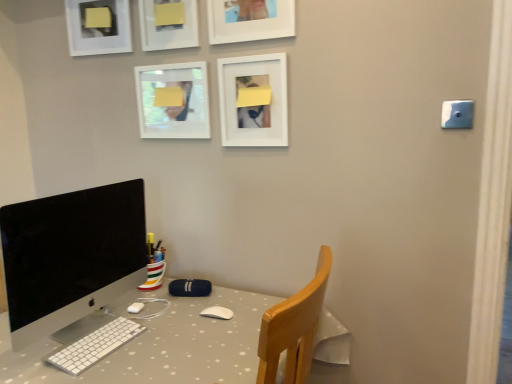
Question: From the image's perspective, is white glossy picture frame at upper center, which appears as the 2th picture frame when viewed from the left, positioned above or below white polka dot desk at center?

Choices:
 (A) above
 (B) below

Answer: (A)

Question: Looking at their shapes, would you say white glossy picture frame at upper center, which appears as the 2th picture frame when viewed from the left, is wider or thinner than white polka dot desk at center?

Choices:
 (A) wide
 (B) thin

Answer: (B)

Question: Considering the real-world distances, which object is farthest from the white glossy picture frame at upper center, which appears as the 2th picture frame when viewed from the left?

Choices:
 (A) blue plastic light switch at upper right
 (B) matte white picture frame at upper left, the 1th picture frame when ordered from left to right
 (C) white matte picture frame at upper center, the 2th picture frame when ordered from right to left
 (D) silver metallic monitor at left
 (E) matte white picture frame at upper center, which ranks as the third picture frame in right-to-left order

Answer: (A)

Question: Which object is the closest to the white polka dot desk at center?

Choices:
 (A) white plastic keyboard at lower left
 (B) matte white picture frame at upper left, which is the 5th picture frame in right-to-left order
 (C) matte white picture frame at upper center, which ranks as the 3th picture frame in left-to-right order
 (D) blue plastic light switch at upper right
 (E) white matte picture frame at upper center, the fifth picture frame in the left-to-right sequence

Answer: (A)